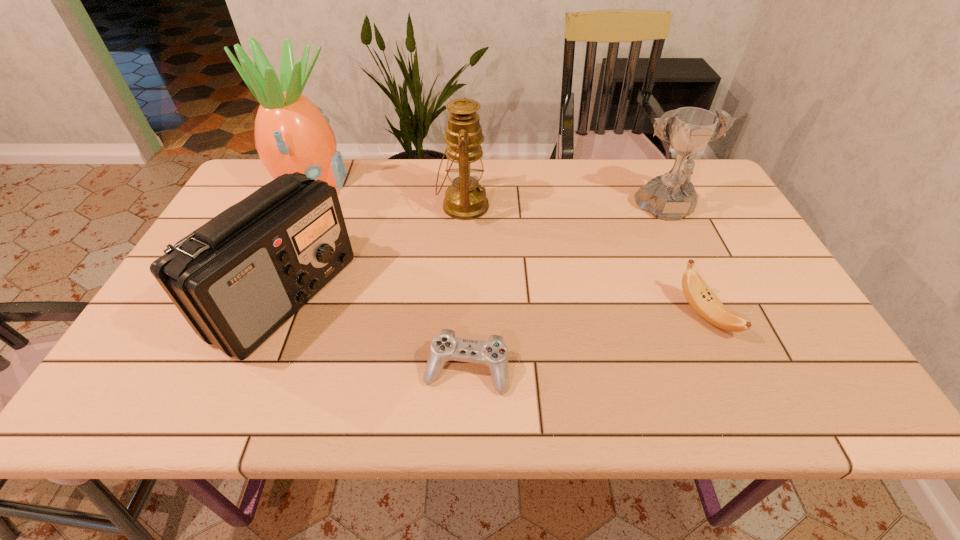
Where is `pineapple`? This screenshot has height=540, width=960. pineapple is located at coordinates (292, 134).

Find the location of a particular element. oil lamp is located at coordinates (465, 199).

At what (x,y) coordinates should I click in order to perform the action: click on award. Please return your answer as a coordinate pair (x, y). The width and height of the screenshot is (960, 540). Looking at the image, I should click on (670, 197).

Locate an element on the screen. The image size is (960, 540). radio receiver is located at coordinates (238, 278).

You are a GUI agent. You are given a task and a screenshot of the screen. Output one action in this format:
    pyautogui.click(x=<x>, y=<y>)
    Task: Click on the second shortest object
    
    Given the screenshot: What is the action you would take?
    pyautogui.click(x=697, y=293)

You are a GUI agent. You are given a task and a screenshot of the screen. Output one action in this format:
    pyautogui.click(x=<x>, y=<y>)
    Task: Click on the shortest object
    Image resolution: width=960 pixels, height=540 pixels.
    Given the screenshot: What is the action you would take?
    pyautogui.click(x=445, y=346)

The height and width of the screenshot is (540, 960). I want to click on vacant area situated at the entrance of the pineapple, so click(x=428, y=182).

Find the location of a particular element. vacant space situated 0.180m on the front of the oil lamp is located at coordinates (460, 275).

You are a GUI agent. You are given a task and a screenshot of the screen. Output one action in this format:
    pyautogui.click(x=<x>, y=<y>)
    Task: Click on the vacant space situated on the side with emblem of the award
    The image size is (960, 540).
    Given the screenshot: What is the action you would take?
    pyautogui.click(x=707, y=296)

The image size is (960, 540). What are the coordinates of `free space located on the front panel of the radio receiver` in the screenshot? It's located at (505, 296).